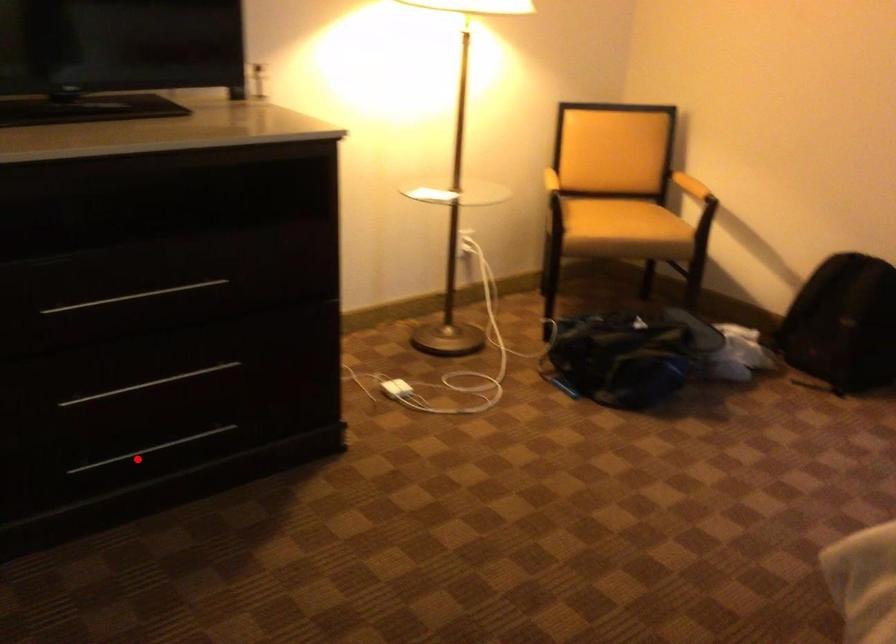
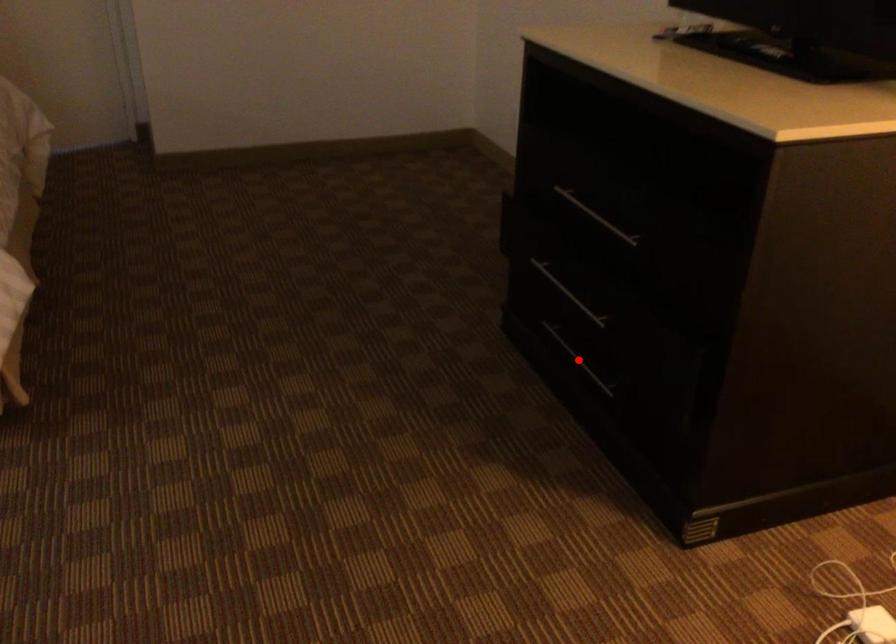
I am providing you with two images of the same scene from different viewpoints. A red point is marked on the first image and another point is marked on the second image. Is the marked point in image1 the same physical position as the marked point in image2?

Yes